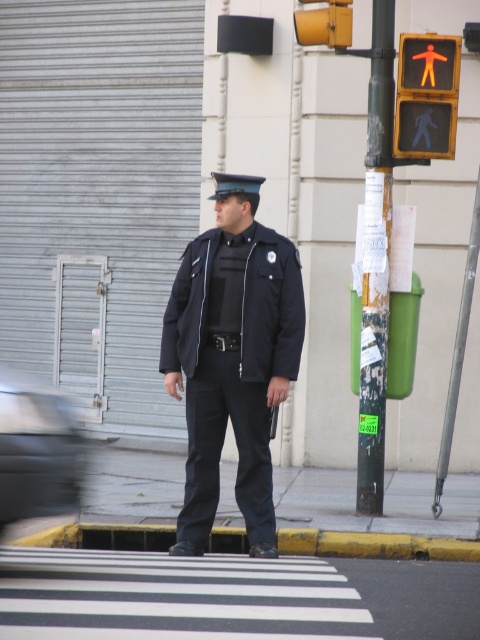
Does matte black uniform at center lie behind orange plastic pedestrian crossing sign at upper center?

No.

Is matte black uniform at center smaller than orange plastic pedestrian crossing sign at upper center?

No.

Which is behind, point (241, 300) or point (429, 65)?

Point (429, 65)

Image resolution: width=480 pixels, height=640 pixels. Find the location of `matte black uniform at center`. matte black uniform at center is located at coordinates (231, 364).

Is point (351, 19) positioned behind point (431, 74)?

Yes, point (351, 19) is farther from viewer.

Between yellow matte traffic light at upper center and orange plastic pedestrian crossing sign at upper center, which one has less height?

Standing shorter between the two is orange plastic pedestrian crossing sign at upper center.

Who is more forward, (326, 8) or (420, 52)?

Point (326, 8)

Where is `yellow matte traffic light at upper center`? yellow matte traffic light at upper center is located at coordinates pos(324,22).

Is orange plastic pedestrian signal at upper right to the left of orange plastic pedestrian crossing sign at upper center from the viewer's perspective?

Indeed, orange plastic pedestrian signal at upper right is positioned on the left side of orange plastic pedestrian crossing sign at upper center.

Can you confirm if orange plastic pedestrian signal at upper right is taller than orange plastic pedestrian crossing sign at upper center?

Yes.

Is point (421, 138) closer to camera compared to point (431, 65)?

No, (421, 138) is behind (431, 65).

Identify the location of orange plastic pedestrian signal at upper right. (427, 96).